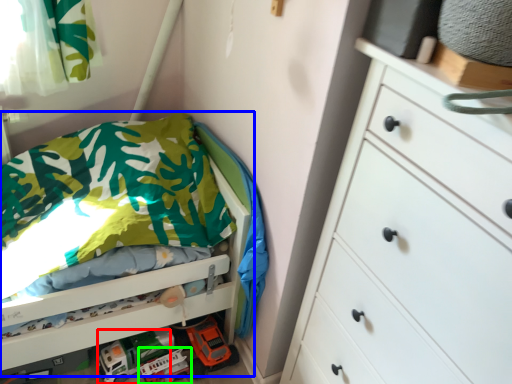
Question: Which object is the farthest from toy car (highlighted by a red box)? Choose among these: bed (highlighted by a blue box) or toy car (highlighted by a green box).

Choices:
 (A) bed
 (B) toy car

Answer: (A)